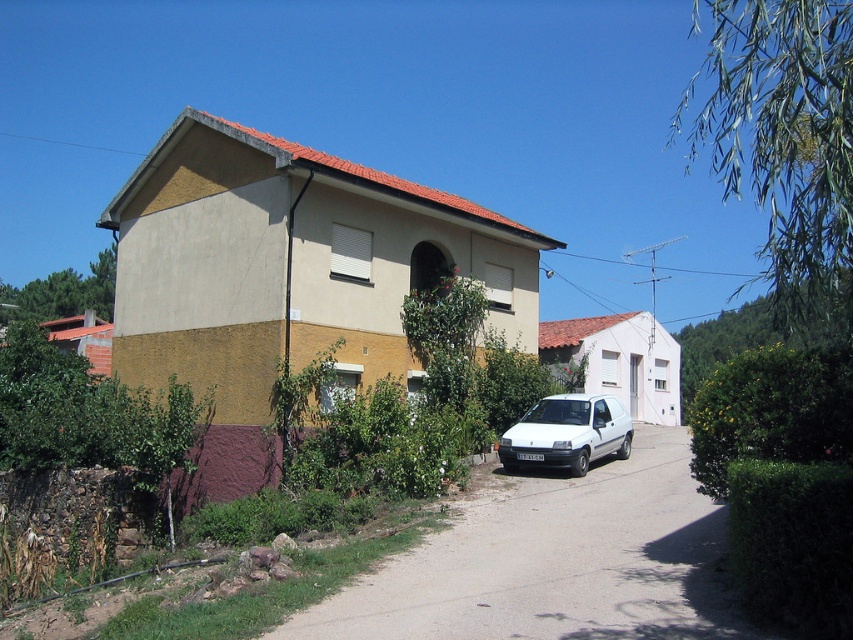
You are a delivery driver who needs to park your white matte van at center in a spot that requires backing into the gray concrete driveway at center. Can the van fit in the driveway if the driveway is shorter than the van?

The gray concrete driveway at center is shorter than the white matte van at center, so the van cannot fit in the driveway as it is too long for the driveway.

You are standing at the point labeled as point (555, 561) in the image. What is the surface material under your feet?

The surface material under your feet is gray concrete driveway at center.